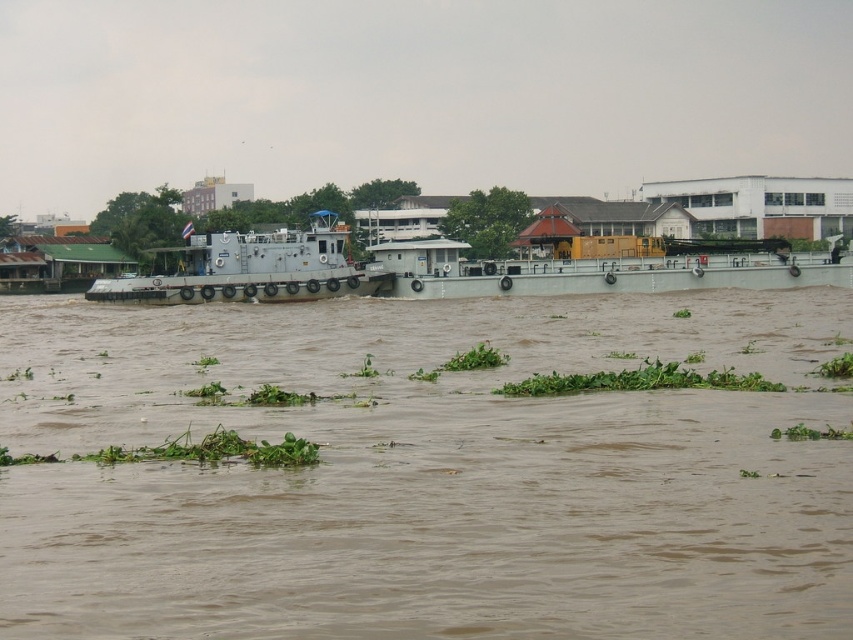
Question: From the image, what is the correct spatial relationship of brown muddy water at center in relation to gray metallic tugboat at center?

Choices:
 (A) right
 (B) left

Answer: (A)

Question: Which of these objects is positioned closest to the gray metallic barge at center?

Choices:
 (A) brown muddy water at center
 (B) gray metallic tugboat at center

Answer: (B)

Question: Where is gray metallic barge at center located in relation to gray metallic tugboat at center in the image?

Choices:
 (A) right
 (B) left

Answer: (A)

Question: Which of the following is the closest to the observer?

Choices:
 (A) brown muddy water at center
 (B) gray metallic barge at center
 (C) gray metallic tugboat at center

Answer: (A)

Question: Is gray metallic barge at center above gray metallic tugboat at center?

Choices:
 (A) yes
 (B) no

Answer: (B)

Question: Estimate the real-world distances between objects in this image. Which object is closer to the brown muddy water at center?

Choices:
 (A) gray metallic barge at center
 (B) gray metallic tugboat at center

Answer: (A)